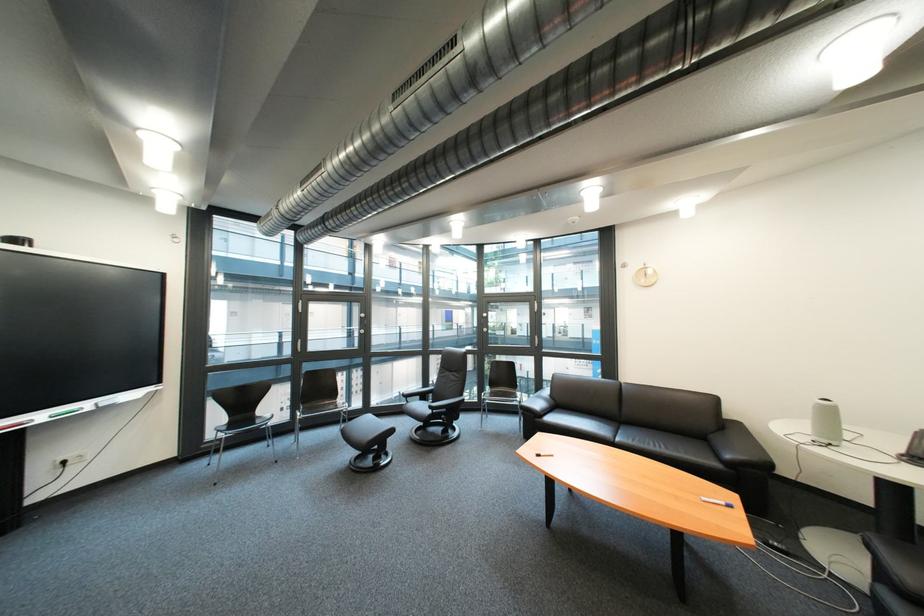
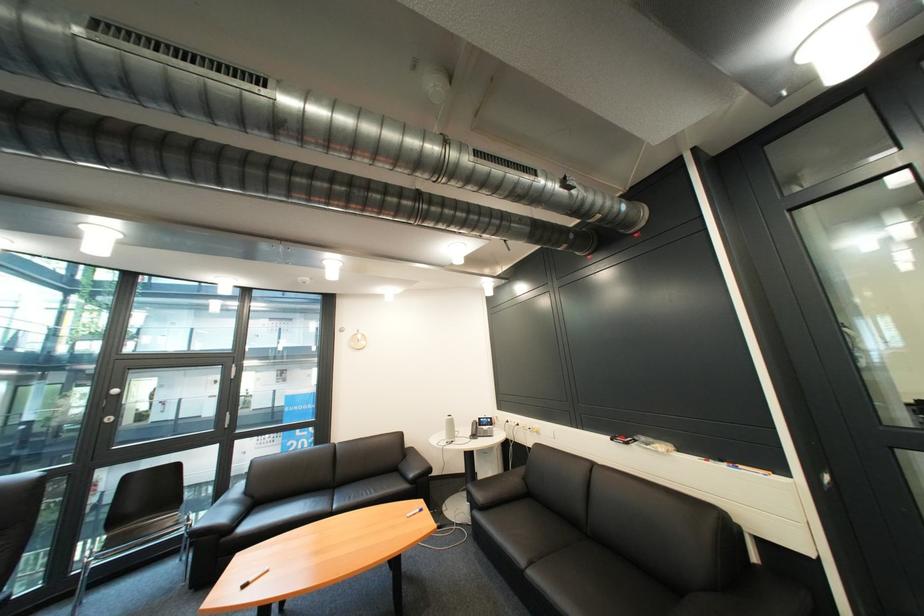
Locate, in the second image, the point that corresponds to [725,439] in the first image.

(414, 468)